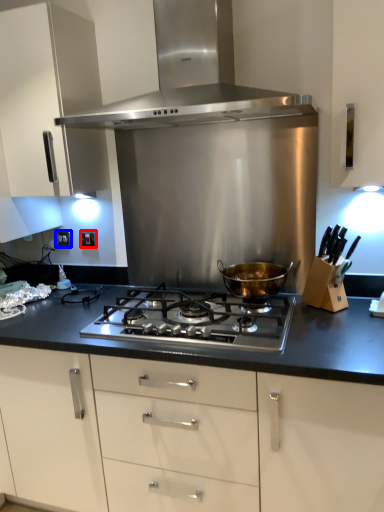
Question: Which object is closer to the camera taking this photo, electric outlet (highlighted by a red box) or electric outlet (highlighted by a blue box)?

Choices:
 (A) electric outlet
 (B) electric outlet

Answer: (A)